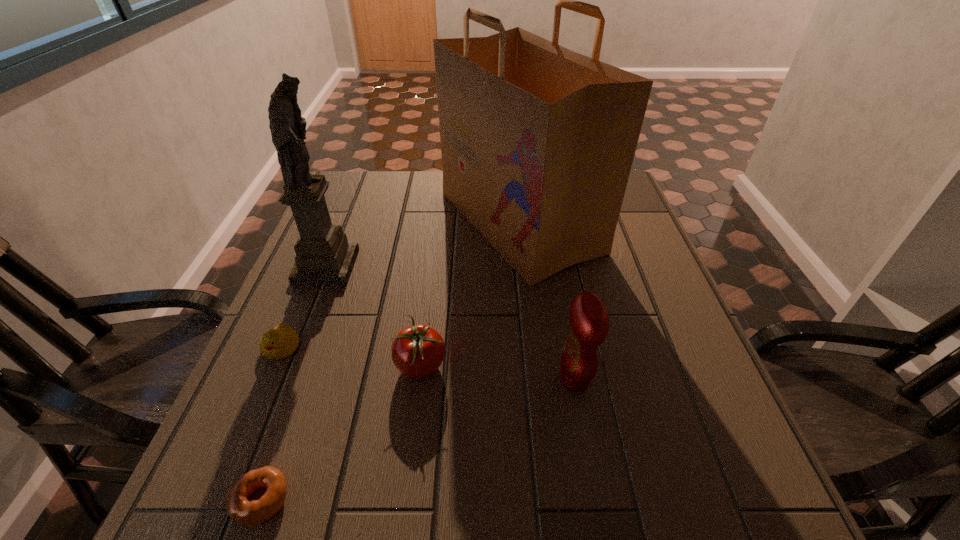
The height and width of the screenshot is (540, 960). What are the coordinates of `free location located 0.260m on the front-facing side of the fifth shortest object` in the screenshot? It's located at (456, 266).

The width and height of the screenshot is (960, 540). Identify the location of vacant region located on the label side of the condiment. (372, 379).

Locate an element on the screen. free space located on the label side of the condiment is located at coordinates (356, 379).

Locate an element on the screen. The image size is (960, 540). free space located 0.120m on the label side of the condiment is located at coordinates (497, 379).

The image size is (960, 540). I want to click on vacant area located on the right of the fourth tallest object, so click(x=476, y=366).

This screenshot has width=960, height=540. I want to click on vacant point located 0.250m on the face of the duckling, so click(221, 489).

I want to click on vacant space located on the right of the doughnut, so click(358, 500).

Identify the location of object at the far edge. (537, 141).

Identify the location of object that is at the near edge. pyautogui.click(x=249, y=513).

Find the location of a particular element. Image resolution: width=960 pixels, height=540 pixels. sculpture at the left edge is located at coordinates (324, 256).